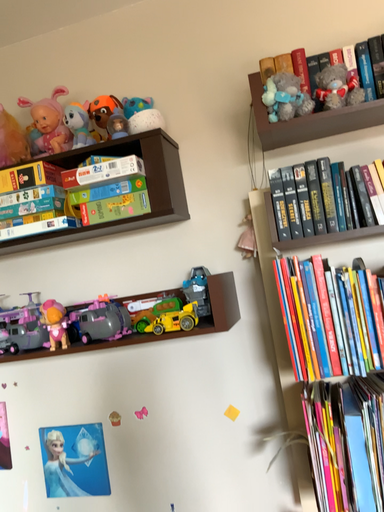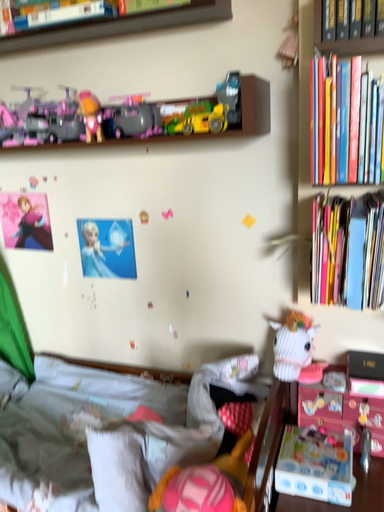
Question: Which way did the camera rotate in the video?

Choices:
 (A) rotated upward
 (B) rotated downward

Answer: (B)